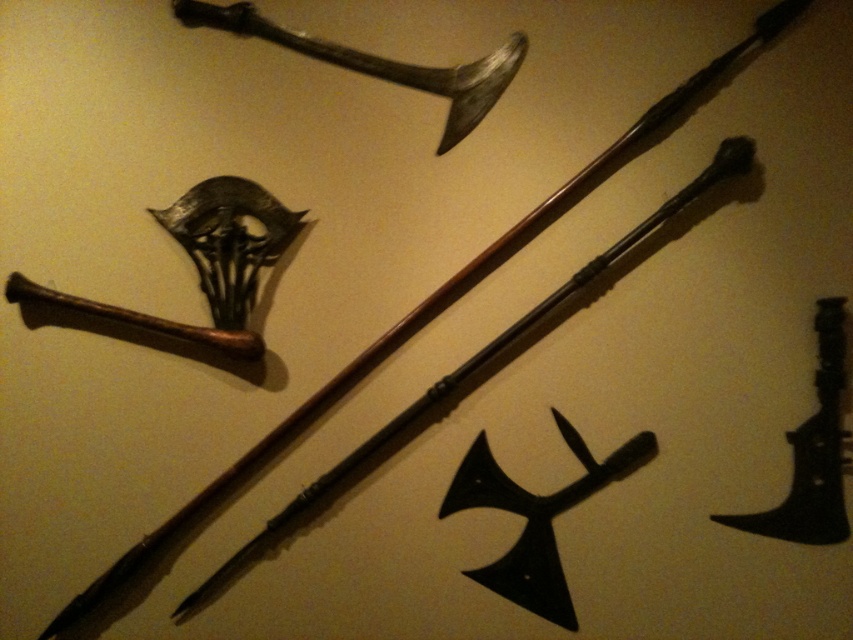
You are an archer standing in front of the medieval weapons display. You need to retrieve the black matte axe at center and the black metal axe at lower right. Which axe will you reach first if you move directly toward the wall?

The black matte axe at center will be reached first because it is closer to you than the black metal axe at lower right, which is positioned further back on the wall.

Looking at this image, you are a medieval knight inspecting the weapons displayed on the wall. You notice the black matte axe at center and the dark brown wooden sword at upper center. Which weapon is positioned higher on the wall?

The dark brown wooden sword at upper center is positioned higher on the wall than the black matte axe at center.